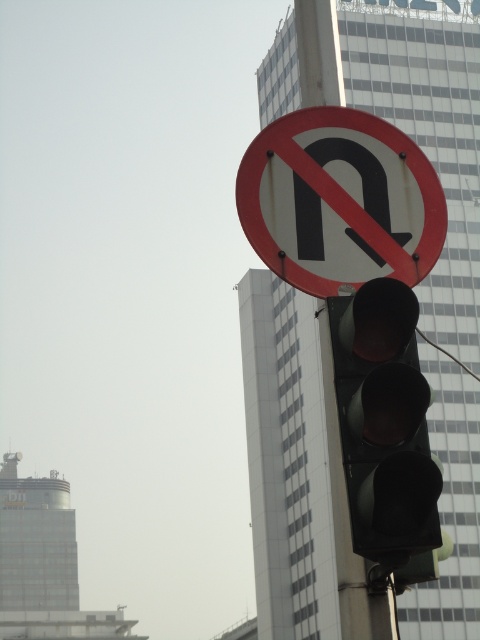
You are a delivery driver approaching an intersection and see the black matte traffic light at center and the red painted circle at upper center. Which object is closer to you?

The black matte traffic light at center is behind the red painted circle at upper center, so the red painted circle at upper center is closer to you.

You are a delivery person with a 1 meter long box. You need to place the box between the red painted circle at upper center and the black matte traffic light at center. Is there enough space?

The distance between the red painted circle at upper center and the black matte traffic light at center is 94.17 centimeters. Since the box is 1 meter long, which is longer than the available space, it won

You are a delivery driver who needs to park your vehicle near the black matte traffic light at center. According to the red painted circle at upper center, is parking allowed here?

The red painted circle at upper center is positioned over the black matte traffic light at center, indicating that parking is prohibited here due to the red circle with a diagonal line over an N symbol, so you cannot park near the black matte traffic light at center.